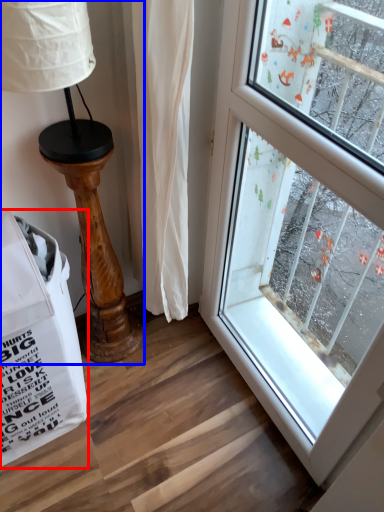
Question: Which object is further to the camera taking this photo, grocery bag (highlighted by a red box) or table lamp (highlighted by a blue box)?

Choices:
 (A) grocery bag
 (B) table lamp

Answer: (B)